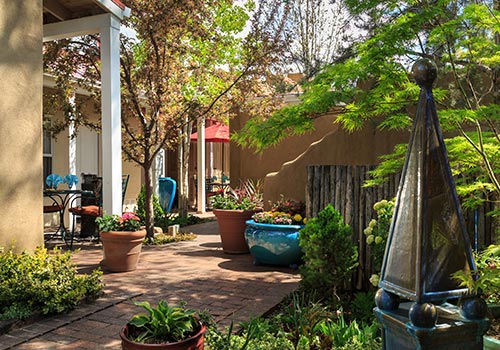
Locate an element on the screen. pot is located at coordinates (118, 258).